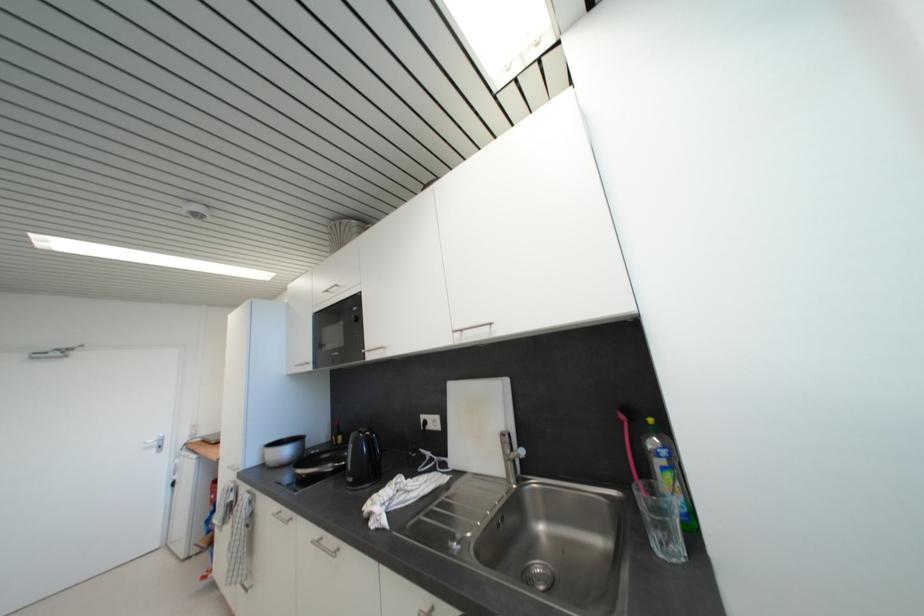
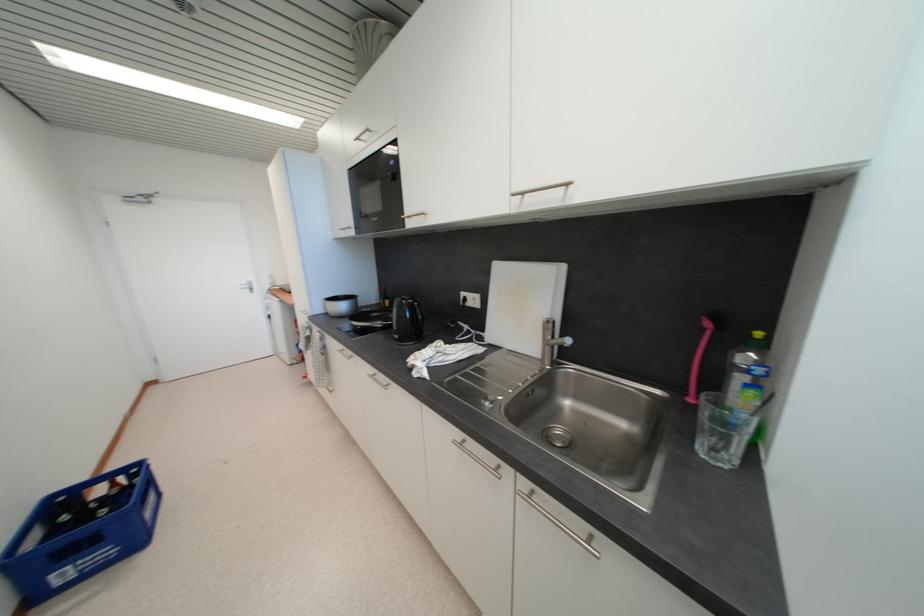
Question: What movement of the cameraman would produce the second image?

Choices:
 (A) Left
 (B) Right
 (C) Forward
 (D) Backward

Answer: (C)